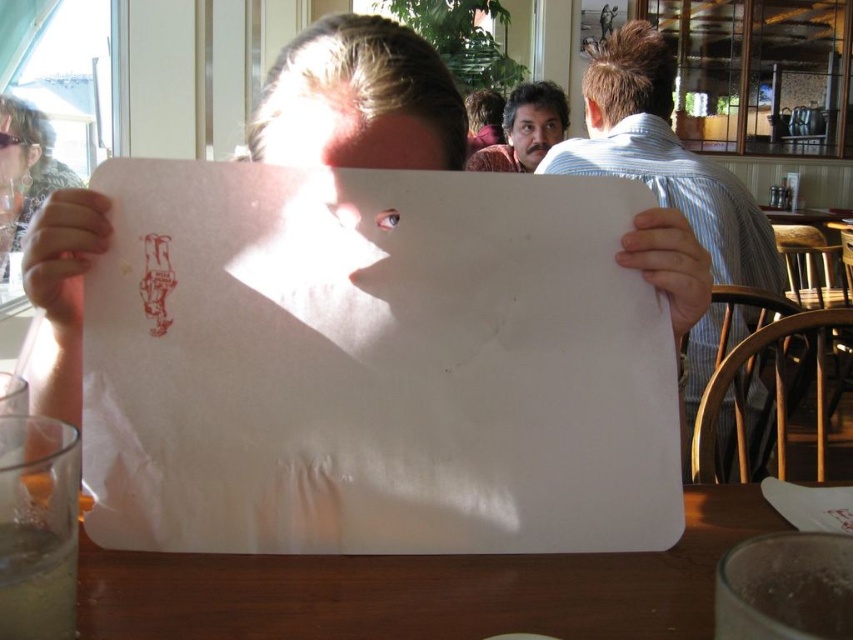
Question: Does wooden table at center have a greater width compared to smooth skin face at upper center?

Choices:
 (A) yes
 (B) no

Answer: (A)

Question: Is white paper at center closer to camera compared to smooth skin face at upper center?

Choices:
 (A) no
 (B) yes

Answer: (B)

Question: Which object appears closest to the camera in this image?

Choices:
 (A) white paper at center
 (B) smooth skin face at upper center
 (C) wooden table at center
 (D) white paper at upper right

Answer: (C)

Question: Which point is farther to the camera?

Choices:
 (A) (x=225, y=586)
 (B) (x=547, y=364)

Answer: (B)

Question: Is white paper at center bigger than wooden table at center?

Choices:
 (A) yes
 (B) no

Answer: (B)

Question: Which object appears farthest from the camera in this image?

Choices:
 (A) wooden table at center
 (B) dark brown hair at upper center
 (C) smooth skin face at upper center
 (D) white paper at center

Answer: (C)